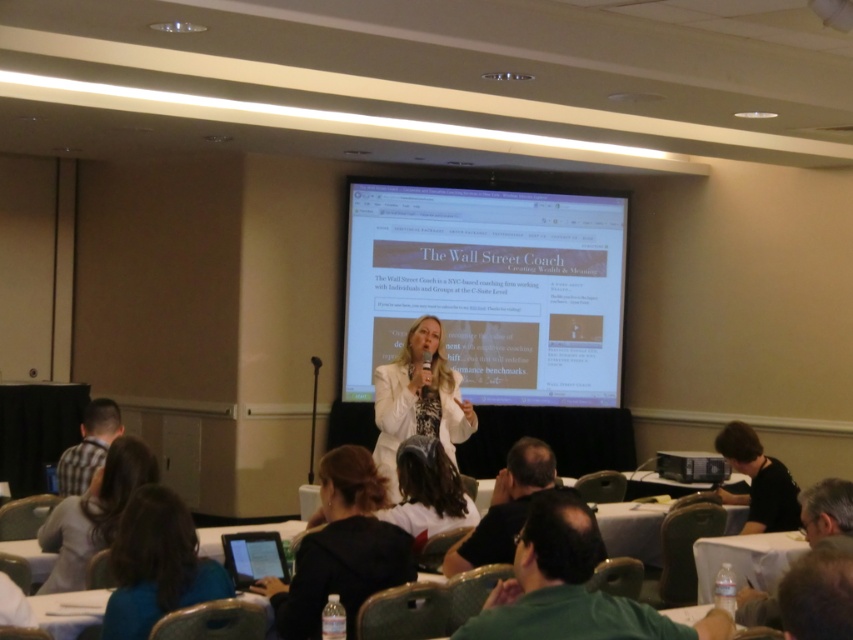
Can you confirm if green fabric shirt at lower right is smaller than black plastic projector at lower right?

Actually, green fabric shirt at lower right might be larger than black plastic projector at lower right.

Is green fabric shirt at lower right shorter than black plastic projector at lower right?

No, green fabric shirt at lower right is not shorter than black plastic projector at lower right.

Does point (546, 604) come behind point (686, 472)?

No.

Find the location of `green fabric shirt at lower right`. green fabric shirt at lower right is located at coordinates (570, 586).

Does point (590, 220) come farther from viewer compared to point (372, 582)?

Yes.

At what (x,y) coordinates should I click in order to perform the action: click on white glossy projector screen at center. Please return your answer as a coordinate pair (x, y). The image size is (853, 640). Looking at the image, I should click on (488, 289).

Does white glossy projector screen at center appear on the right side of black plastic projector at lower right?

No, white glossy projector screen at center is not to the right of black plastic projector at lower right.

Can you confirm if white glossy projector screen at center is wider than black plastic projector at lower right?

Yes, white glossy projector screen at center is wider than black plastic projector at lower right.

Image resolution: width=853 pixels, height=640 pixels. Describe the element at coordinates (488, 289) in the screenshot. I see `white glossy projector screen at center` at that location.

In order to click on white glossy projector screen at center in this screenshot , I will do `click(488, 289)`.